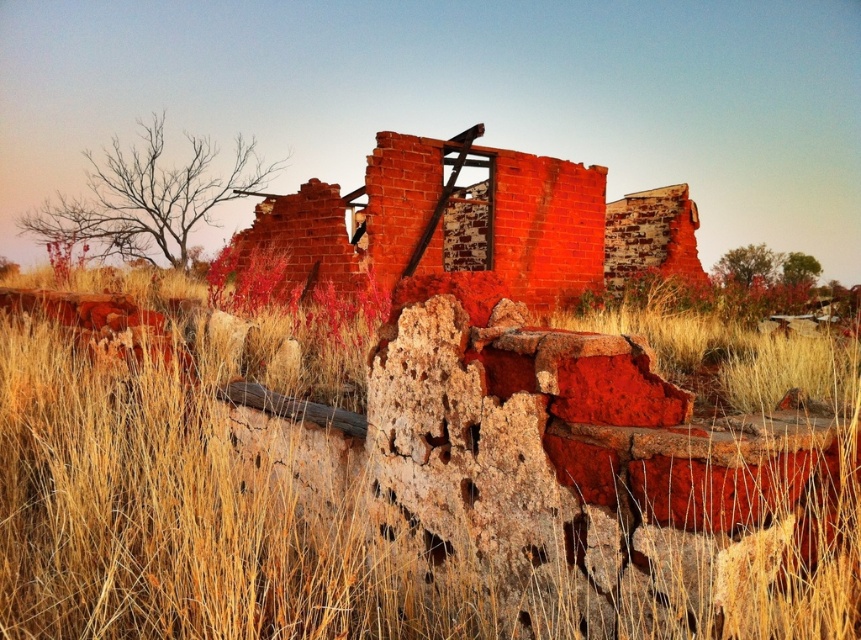
Which is more to the left, dry grass at center or brick wall at center?

dry grass at center is more to the left.

Which of these two, dry grass at center or brick wall at center, stands shorter?

Standing shorter between the two is dry grass at center.

At what (x,y) coordinates should I click in order to perform the action: click on dry grass at center. Please return your answer as a coordinate pair (x, y). Looking at the image, I should click on (409, 499).

Locate an element on the screen. dry grass at center is located at coordinates (409, 499).